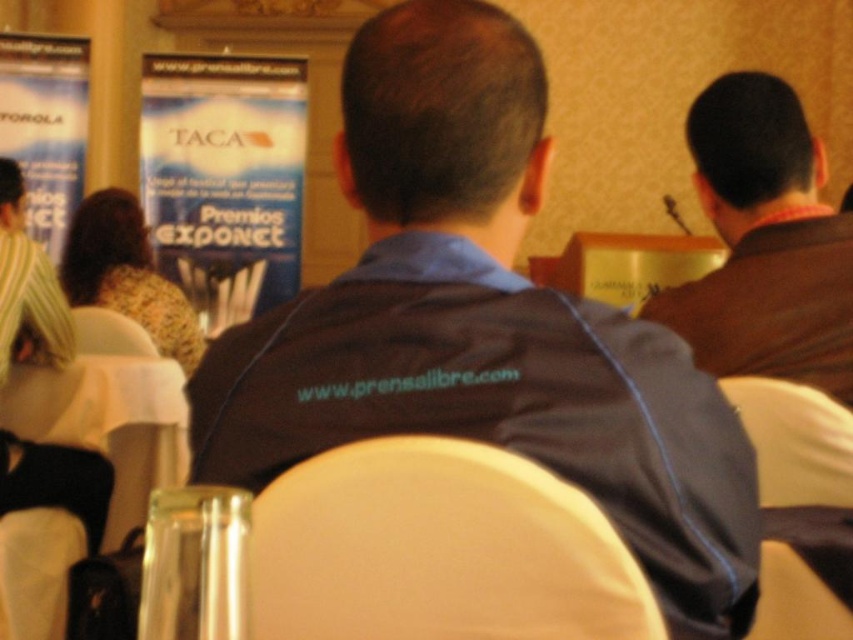
Question: Which object appears closest to the camera in this image?

Choices:
 (A) brown leather jacket at upper right
 (B) white plastic chair at center
 (C) striped fabric shirt at left

Answer: (B)

Question: Does dark blue fabric vest at center have a lesser width compared to white plastic chair at center?

Choices:
 (A) yes
 (B) no

Answer: (B)

Question: Is blue fabric banner at upper left wider than striped fabric shirt at left?

Choices:
 (A) yes
 (B) no

Answer: (A)

Question: Which point is closer to the camera taking this photo?

Choices:
 (A) (824, 572)
 (B) (51, 248)
 (C) (457, 556)

Answer: (C)

Question: Which point is closer to the camera?

Choices:
 (A) blue paperboard poster at upper left
 (B) blue fabric banner at upper left

Answer: (A)

Question: Does white fabric chair at center have a smaller size compared to white plastic chair at center?

Choices:
 (A) yes
 (B) no

Answer: (A)